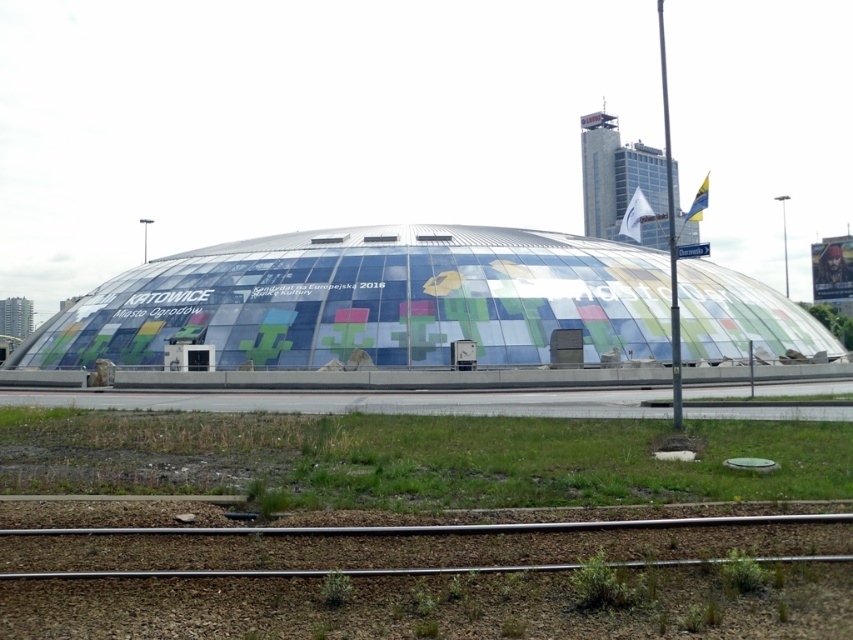
Which is more to the right, metallic train track at lower center or green grass at lower center?

From the viewer's perspective, metallic train track at lower center appears more on the right side.

Consider the image. Which is above, metallic train track at lower center or green grass at lower center?

metallic train track at lower center is higher up.

Identify the location of metallic train track at lower center. The width and height of the screenshot is (853, 640). (428, 586).

Who is taller, transparent glass dome at center or green grass at lower center?

With more height is transparent glass dome at center.

Where is `transparent glass dome at center`? transparent glass dome at center is located at coordinates (373, 300).

Identify the location of transparent glass dome at center. Image resolution: width=853 pixels, height=640 pixels. (373, 300).

Is metallic train track at lower center thinner than transparent glass dome at center?

Indeed, metallic train track at lower center has a lesser width compared to transparent glass dome at center.

Is metallic train track at lower center to the left of transparent glass dome at center from the viewer's perspective?

In fact, metallic train track at lower center is to the right of transparent glass dome at center.

Which is behind, point (381, 593) or point (445, 284)?

Point (445, 284)

Where is `metallic train track at lower center`? Image resolution: width=853 pixels, height=640 pixels. metallic train track at lower center is located at coordinates (428, 586).